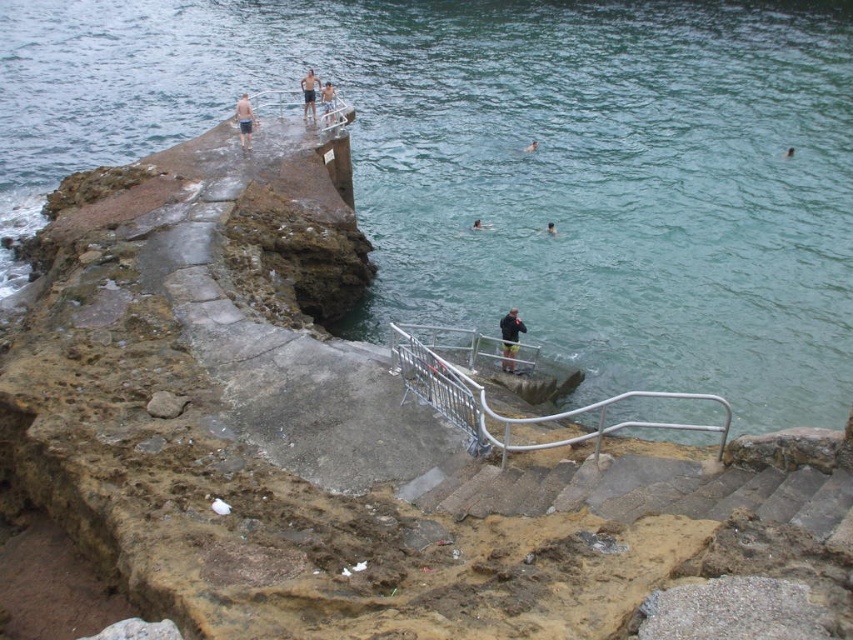
Does light blue shorts at center appear on the left side of skinny man at lower center?

Indeed, light blue shorts at center is positioned on the left side of skinny man at lower center.

Between point (323, 84) and point (550, 230), which one is positioned in front?

Point (550, 230)

Who is more distant from viewer, (323,102) or (548,225)?

The point (548,225) is more distant.

What are the coordinates of `light blue shorts at center` in the screenshot? It's located at (328, 100).

Does skinny man at upper center appear on the left side of brown skin at water center?

Yes, skinny man at upper center is to the left of brown skin at water center.

Between point (244, 141) and point (788, 147), which one is positioned behind?

The point (788, 147) is behind.

Describe the element at coordinates (244, 120) in the screenshot. This screenshot has height=640, width=853. I see `skinny man at upper center` at that location.

Identify the location of skinny man at upper center. Image resolution: width=853 pixels, height=640 pixels. (244, 120).

Is point (323, 90) positioned after point (531, 148)?

That is False.

Based on the photo, who is taller, light blue shorts at center or brown skin at water?

light blue shorts at center is taller.

Does point (328, 100) come closer to viewer compared to point (527, 145)?

Yes, it is in front of point (527, 145).

Where is `light blue shorts at center`? light blue shorts at center is located at coordinates (328, 100).